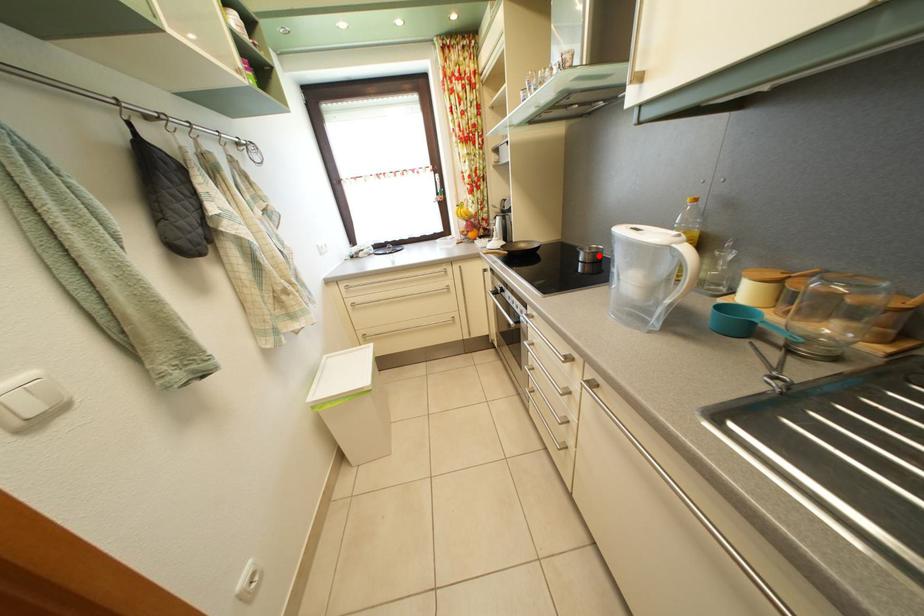
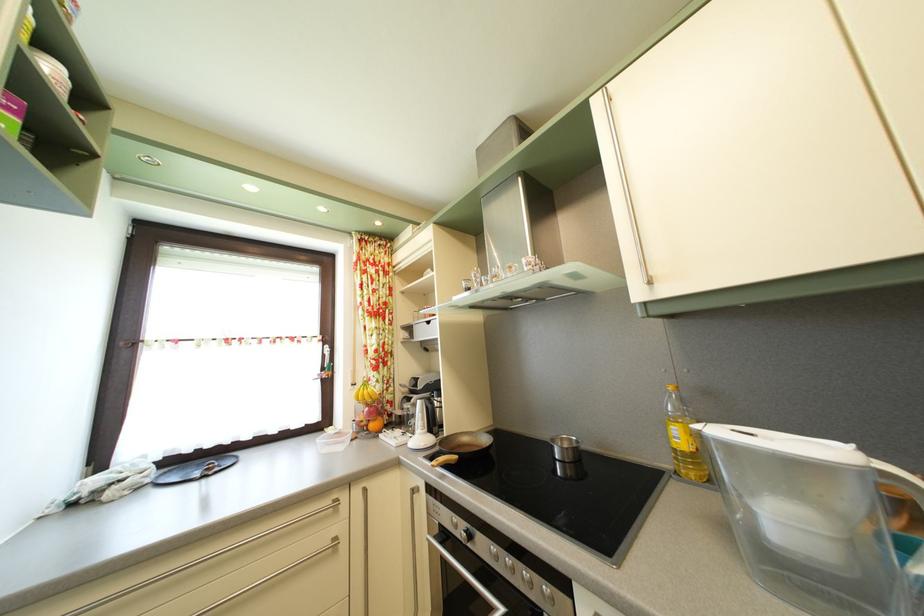
The point at the highlighted location is marked in the first image. Where is the corresponding point in the second image?

(569, 448)